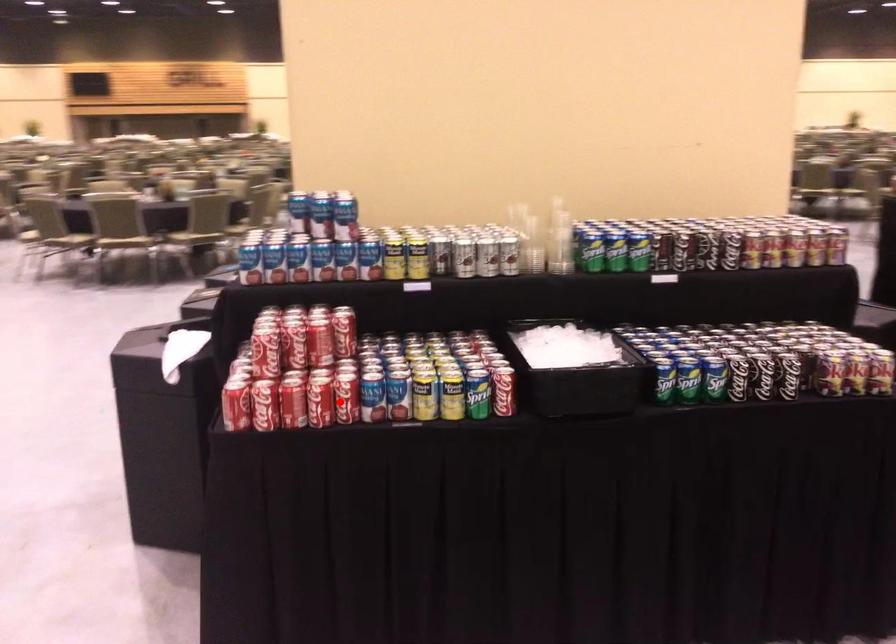
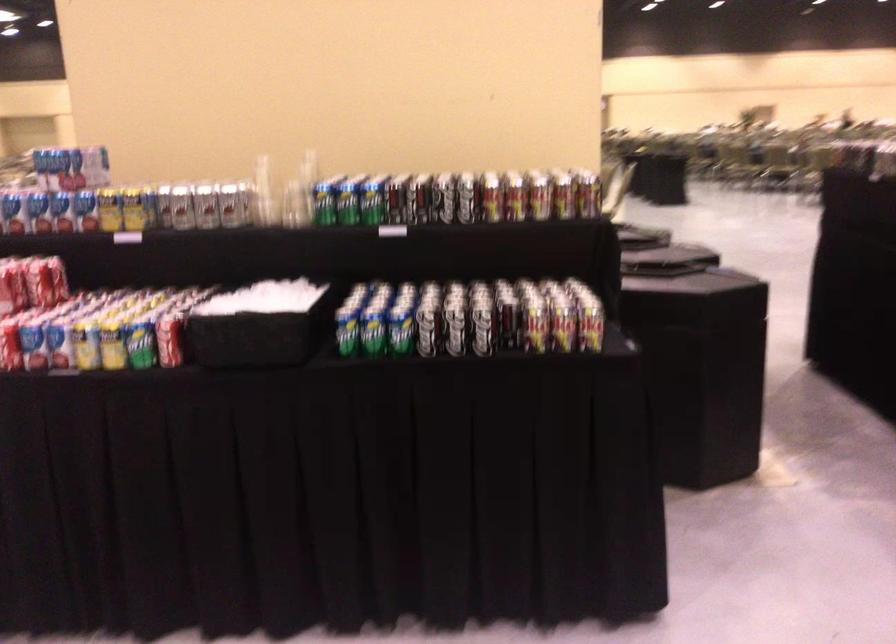
The point at the highlighted location is marked in the first image. Where is the corresponding point in the second image?

(10, 346)